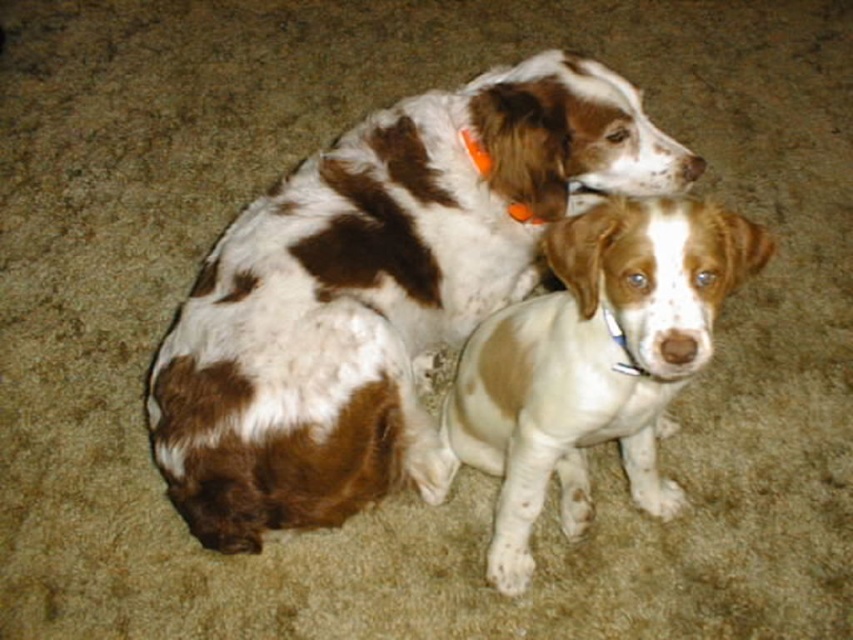
Can you confirm if white speckled fur at center is taller than orange plastic collar at upper center?

Correct, white speckled fur at center is much taller as orange plastic collar at upper center.

Is point (689, 356) more distant than point (486, 163)?

No.

Is point (683, 204) closer to viewer compared to point (483, 164)?

Yes, point (683, 204) is in front of point (483, 164).

The width and height of the screenshot is (853, 640). In order to click on white speckled fur at center in this screenshot , I will do `click(593, 362)`.

Can you confirm if brown and white fur at center is positioned to the left of white speckled fur at center?

Yes, brown and white fur at center is to the left of white speckled fur at center.

Find the location of a particular element. brown and white fur at center is located at coordinates (375, 291).

Looking at this image, is brown and white fur at center below orange plastic collar at upper center?

Yes.

Can you confirm if brown and white fur at center is taller than orange plastic collar at upper center?

Answer: Correct, brown and white fur at center is much taller as orange plastic collar at upper center.

Is point (276, 198) farther from viewer compared to point (465, 140)?

Yes, point (276, 198) is farther from viewer.

Identify the location of brown and white fur at center. The width and height of the screenshot is (853, 640). (375, 291).